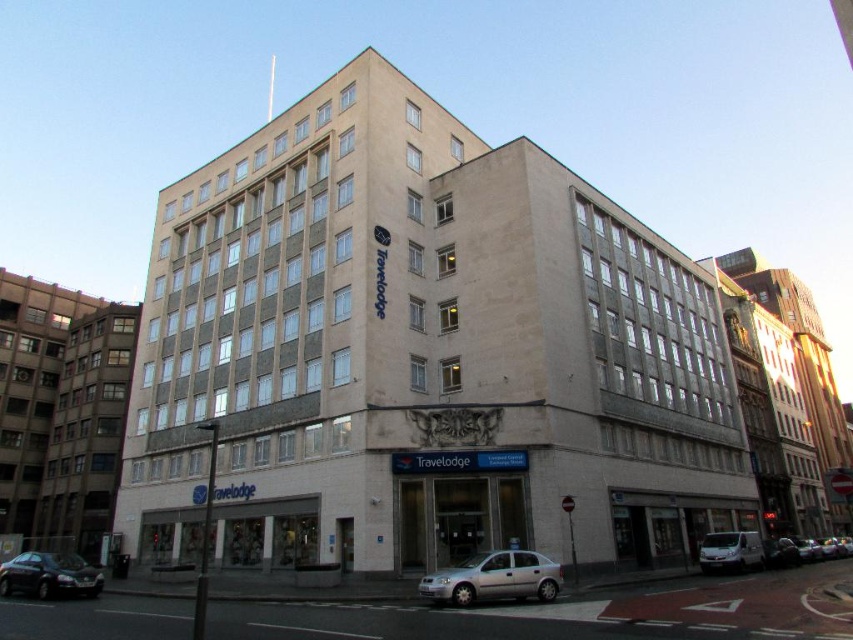
You are standing at the entrance of the Travelodge hotel and want to park your car. The parking lot has a designated parking spot at point 0.905, 0.580. Is the silver metallic car at lower center currently occupying that spot?

The silver metallic car at lower center is positioned at point (494, 579), so yes, it is occupying the designated parking spot.

You are a delivery driver who needs to back out of the parking spot between the silver metallic car at lower center and the matte black sedan at lower left. Can you safely back out without hitting either vehicle?

The silver metallic car at lower center is in front of the matte black sedan at lower left, so the matte black sedan at lower left is behind the silver metallic car. Since you are in the parking spot between them, you can safely back out by moving backward towards the matte black sedan at lower left as it is behind you.

You are standing at the point with coordinates point (19, 580) and want to walk towards the point with coordinates point (486, 593). Which direction should you move to get closer to your destination?

You should move towards the point (486, 593) because it is closer to the camera than the point (19, 580) you are currently at.